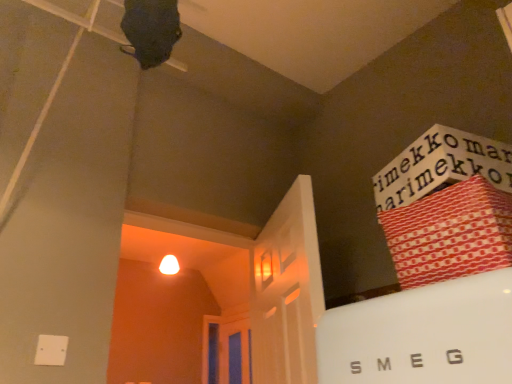
Question: Is blue glass door at center behind red paper bag at upper right?

Choices:
 (A) no
 (B) yes

Answer: (B)

Question: Is blue glass door at center in front of red paper bag at upper right?

Choices:
 (A) no
 (B) yes

Answer: (A)

Question: Can we say blue glass door at center lies outside red paper bag at upper right?

Choices:
 (A) no
 (B) yes

Answer: (B)

Question: Is blue glass door at center not close to red paper bag at upper right?

Choices:
 (A) no
 (B) yes

Answer: (B)

Question: Can you see blue glass door at center touching red paper bag at upper right?

Choices:
 (A) no
 (B) yes

Answer: (A)

Question: From the image's perspective, is blue glass door at center over red paper bag at upper right?

Choices:
 (A) yes
 (B) no

Answer: (B)

Question: Is red paper bag at upper right surrounding blue glass door at center?

Choices:
 (A) no
 (B) yes

Answer: (A)

Question: Is there a large distance between red paper bag at upper right and blue glass door at center?

Choices:
 (A) yes
 (B) no

Answer: (A)

Question: Can you confirm if red paper bag at upper right is taller than blue glass door at center?

Choices:
 (A) no
 (B) yes

Answer: (A)

Question: Considering the relative sizes of red paper bag at upper right and blue glass door at center in the image provided, is red paper bag at upper right thinner than blue glass door at center?

Choices:
 (A) no
 (B) yes

Answer: (A)

Question: Can you confirm if red paper bag at upper right is wider than blue glass door at center?

Choices:
 (A) no
 (B) yes

Answer: (B)

Question: Can you confirm if red paper bag at upper right is shorter than blue glass door at center?

Choices:
 (A) yes
 (B) no

Answer: (A)

Question: Looking at their shapes, would you say red paper bag at upper right is wider or thinner than blue glass door at center?

Choices:
 (A) wide
 (B) thin

Answer: (A)